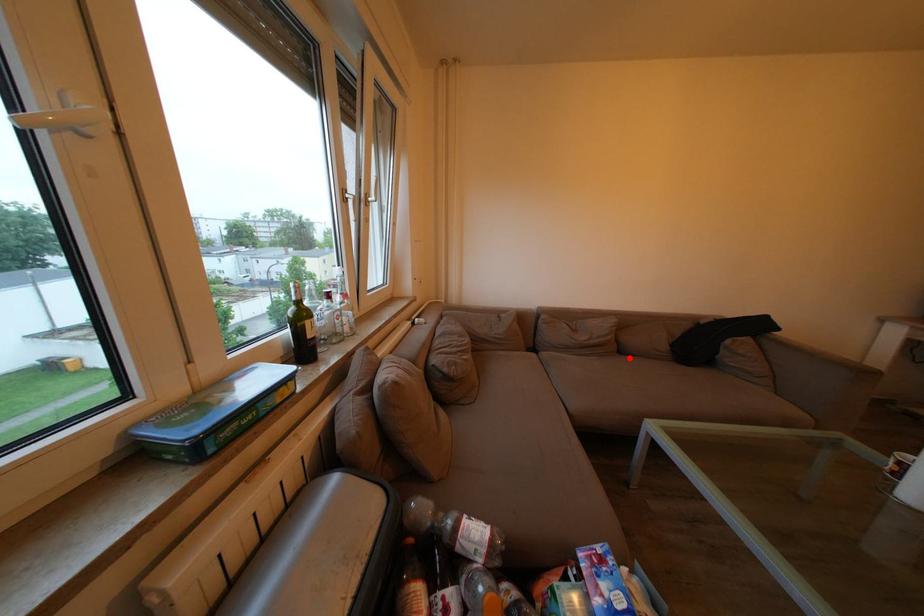
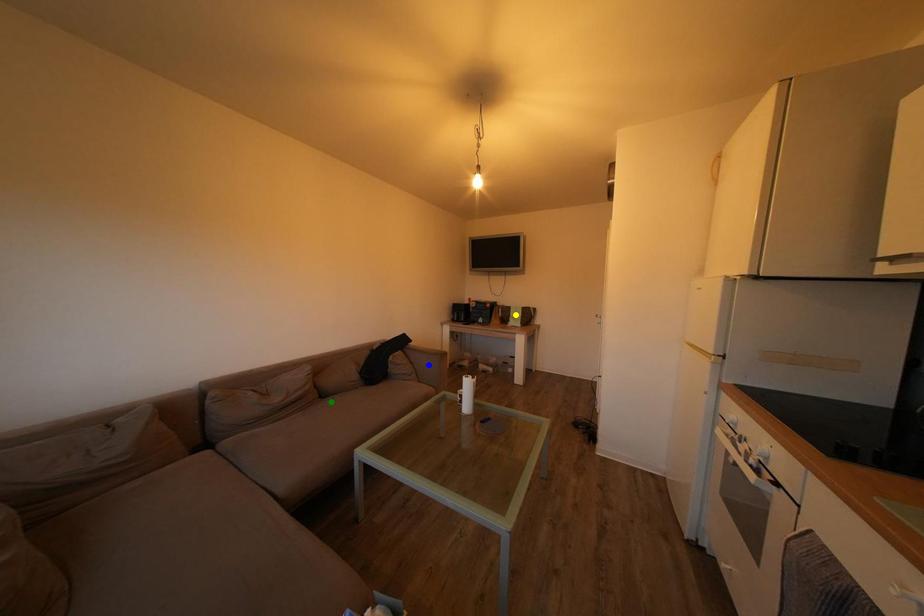
Question: I am providing you with two images of the same scene from different viewpoints. A red point is marked on the first image. You are given multiple points on the second image. Which spot in image 2 lines up with the point in image 1?

Choices:
 (A) blue point
 (B) yellow point
 (C) green point

Answer: (C)